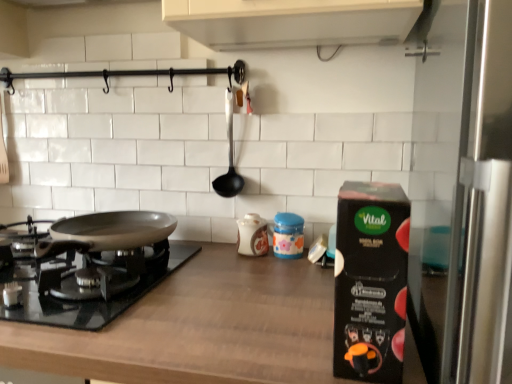
Question: Is the depth of brown wood countertop at center greater than that of black plastic ladle at center?

Choices:
 (A) no
 (B) yes

Answer: (A)

Question: Is brown wood countertop at center surrounding black plastic ladle at center?

Choices:
 (A) yes
 (B) no

Answer: (B)

Question: Does brown wood countertop at center have a greater width compared to black plastic ladle at center?

Choices:
 (A) yes
 (B) no

Answer: (A)

Question: Can you confirm if brown wood countertop at center is taller than black plastic ladle at center?

Choices:
 (A) no
 (B) yes

Answer: (B)

Question: Is brown wood countertop at center to the left of black plastic ladle at center from the viewer's perspective?

Choices:
 (A) no
 (B) yes

Answer: (B)

Question: Considering the positions of matte ceramic jar at center, placed as the 3th kitchen appliance when sorted from right to left, and brown wood countertop at center in the image, is matte ceramic jar at center, placed as the 3th kitchen appliance when sorted from right to left, wider or thinner than brown wood countertop at center?

Choices:
 (A) thin
 (B) wide

Answer: (A)

Question: Relative to brown wood countertop at center, is matte ceramic jar at center, arranged as the 1th kitchen appliance when viewed from the left, in front or behind?

Choices:
 (A) front
 (B) behind

Answer: (B)

Question: Considering the positions of matte ceramic jar at center, placed as the 3th kitchen appliance when sorted from right to left, and brown wood countertop at center in the image, is matte ceramic jar at center, placed as the 3th kitchen appliance when sorted from right to left, bigger or smaller than brown wood countertop at center?

Choices:
 (A) small
 (B) big

Answer: (A)

Question: Would you say matte ceramic jar at center, the 1th kitchen appliance in the back-to-front sequence, is to the left or to the right of brown wood countertop at center in the picture?

Choices:
 (A) left
 (B) right

Answer: (B)

Question: Considering their positions, is black plastic ladle at center located in front of or behind matte ceramic jar at center, which is the second kitchen appliance in front-to-back order?

Choices:
 (A) front
 (B) behind

Answer: (B)

Question: Does point (230, 114) appear closer or farther from the camera than point (294, 231)?

Choices:
 (A) farther
 (B) closer

Answer: (A)

Question: From a real-world perspective, is black plastic ladle at center positioned above or below matte ceramic jar at center, acting as the second kitchen appliance starting from the left?

Choices:
 (A) below
 (B) above

Answer: (B)

Question: Would you say black plastic ladle at center is inside or outside matte ceramic jar at center, acting as the second kitchen appliance starting from the left?

Choices:
 (A) inside
 (B) outside

Answer: (B)

Question: Would you say silver metallic pan at lower left is to the left or to the right of black cardboard box at right, which is counted as the 3th kitchen appliance, starting from the left, in the picture?

Choices:
 (A) right
 (B) left

Answer: (B)

Question: From a real-world perspective, relative to black cardboard box at right, which appears as the 1th kitchen appliance when viewed from the front, is silver metallic pan at lower left vertically above or below?

Choices:
 (A) below
 (B) above

Answer: (A)